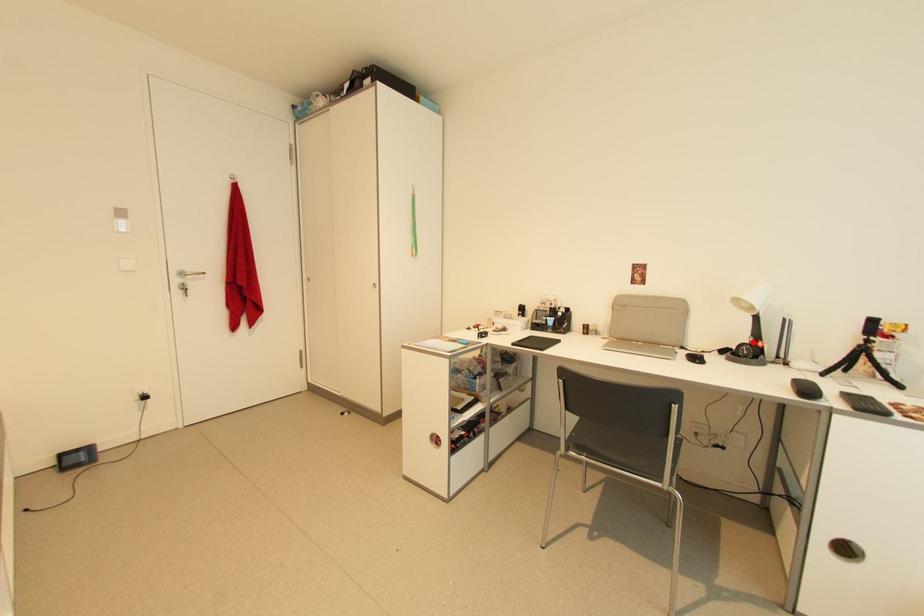
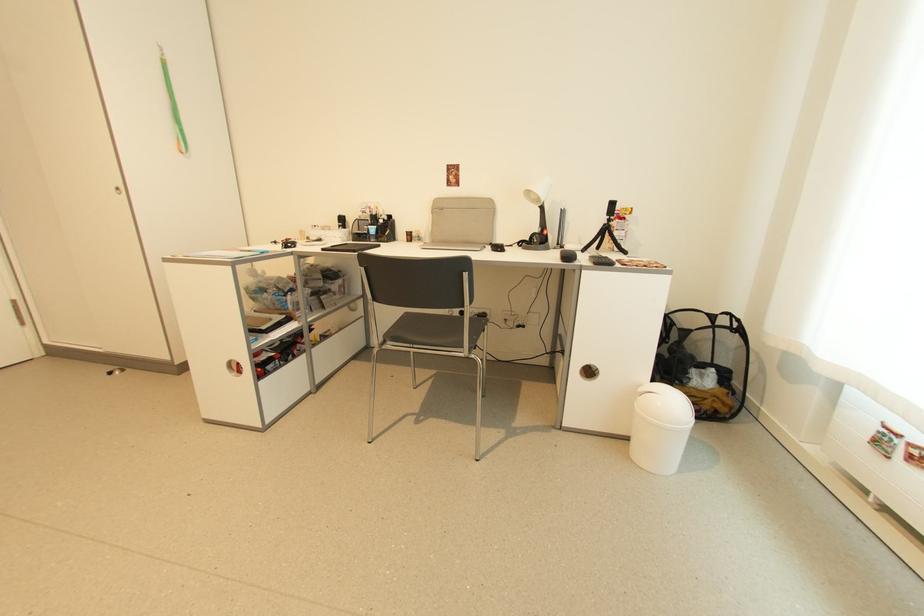
In the second image, find the point that corresponds to the highlighted location in the first image.

(541, 232)